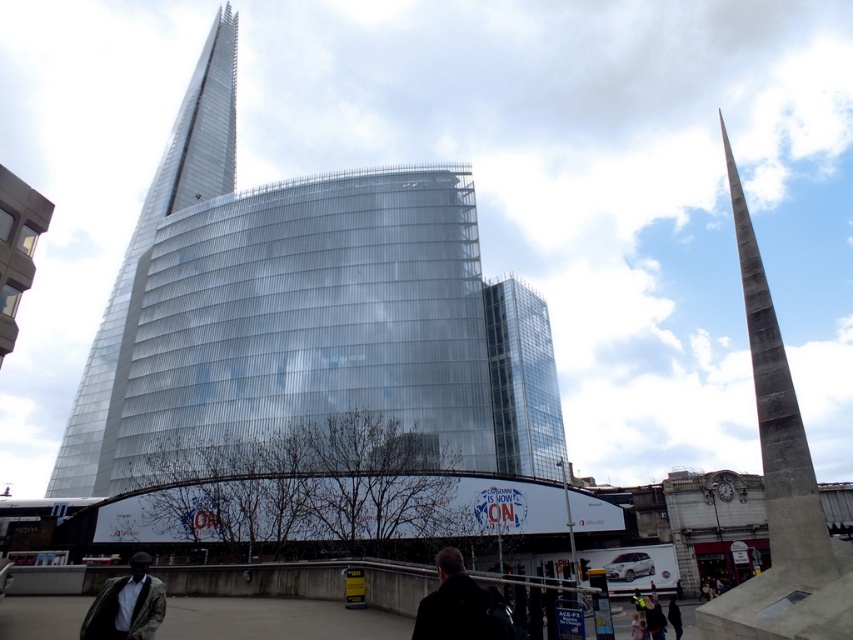
Is polished glass spire at upper left smaller than light brown leather jacket at lower left?

No, polished glass spire at upper left is not smaller than light brown leather jacket at lower left.

Between point (199, 166) and point (120, 625), which one is positioned in front?

Point (120, 625) is in front.

Who is more distant from viewer, (122,349) or (125,634)?

The point (122,349) is more distant.

You are a GUI agent. You are given a task and a screenshot of the screen. Output one action in this format:
    pyautogui.click(x=<x>, y=<y>)
    Task: Click on the polished glass spire at upper left
    
    Given the screenshot: What is the action you would take?
    pyautogui.click(x=149, y=259)

Which of these two, concrete obelisk at right or dark hair at center, stands taller?

With more height is concrete obelisk at right.

Who is positioned more to the left, concrete obelisk at right or dark hair at center?

dark hair at center is more to the left.

Which is in front, point (784, 600) or point (675, 614)?

Point (784, 600)

The width and height of the screenshot is (853, 640). In order to click on concrete obelisk at right in this screenshot , I will do `click(780, 486)`.

Looking at this image, which of these two, concrete obelisk at right or transparent glass tower at center, stands taller?

concrete obelisk at right

What do you see at coordinates (780, 486) in the screenshot? I see `concrete obelisk at right` at bounding box center [780, 486].

Locate an element on the screen. This screenshot has width=853, height=640. concrete obelisk at right is located at coordinates (780, 486).